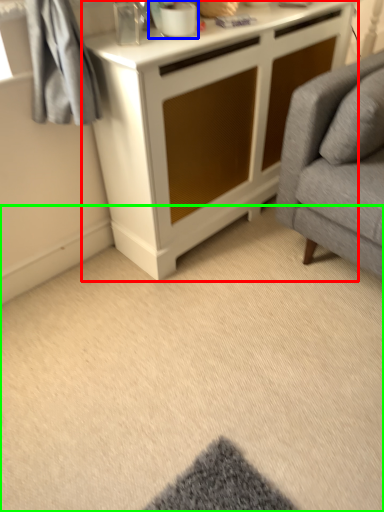
Question: Considering the real-world distances, which object is farthest from cabinetry (highlighted by a red box)? appliance (highlighted by a blue box) or plain (highlighted by a green box)?

Choices:
 (A) appliance
 (B) plain

Answer: (B)